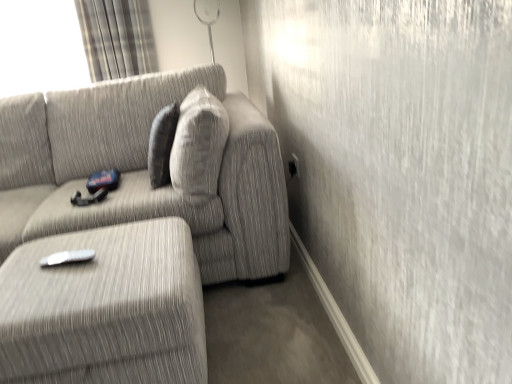
This screenshot has height=384, width=512. I want to click on free space that is to the left of white plastic remote at lower left, so click(30, 261).